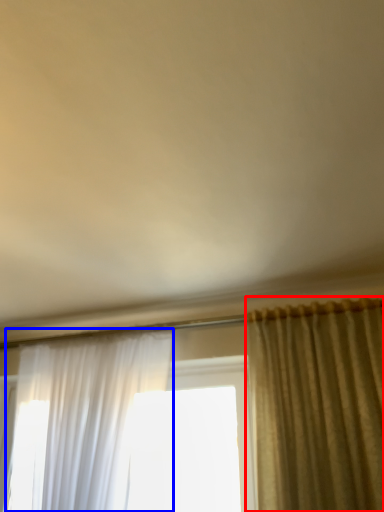
Question: Which object appears closest to the camera in this image, curtain (highlighted by a red box) or curtain (highlighted by a blue box)?

Choices:
 (A) curtain
 (B) curtain

Answer: (A)